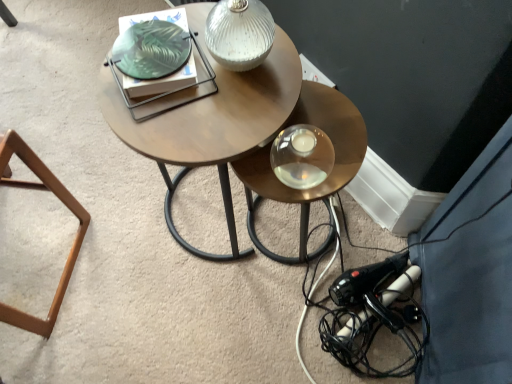
Question: Does white textured glass table lamp at upper center have a greater height compared to black plastic hairdryer at lower right?

Choices:
 (A) no
 (B) yes

Answer: (B)

Question: Is white textured glass table lamp at upper center far away from black plastic hairdryer at lower right?

Choices:
 (A) no
 (B) yes

Answer: (A)

Question: Does white textured glass table lamp at upper center have a lesser width compared to black plastic hairdryer at lower right?

Choices:
 (A) no
 (B) yes

Answer: (B)

Question: From a real-world perspective, is white textured glass table lamp at upper center over black plastic hairdryer at lower right?

Choices:
 (A) yes
 (B) no

Answer: (A)

Question: Is white textured glass table lamp at upper center facing towards black plastic hairdryer at lower right?

Choices:
 (A) yes
 (B) no

Answer: (B)

Question: From a real-world perspective, relative to metallic gold table at center, is woodenmaterial/texturecoffee table at center vertically above or below?

Choices:
 (A) above
 (B) below

Answer: (A)

Question: Is woodenmaterial/texturecoffee table at center taller or shorter than metallic gold table at center?

Choices:
 (A) tall
 (B) short

Answer: (A)

Question: Based on their positions, is woodenmaterial/texturecoffee table at center located to the left or right of metallic gold table at center?

Choices:
 (A) right
 (B) left

Answer: (B)

Question: Considering the positions of point (218, 162) and point (323, 86), is point (218, 162) closer or farther from the camera than point (323, 86)?

Choices:
 (A) closer
 (B) farther

Answer: (A)

Question: In the image, is metallic gold table at center on the left side or the right side of brown wooden stool at lower left?

Choices:
 (A) left
 (B) right

Answer: (B)

Question: From the image's perspective, relative to brown wooden stool at lower left, is metallic gold table at center above or below?

Choices:
 (A) above
 (B) below

Answer: (A)

Question: Is metallic gold table at center situated inside brown wooden stool at lower left or outside?

Choices:
 (A) outside
 (B) inside

Answer: (A)

Question: Is metallic gold table at center in front of or behind brown wooden stool at lower left in the image?

Choices:
 (A) front
 (B) behind

Answer: (B)

Question: Based on their sizes in the image, would you say white textured glass table lamp at upper center is bigger or smaller than black plastic hairdryer at lower right?

Choices:
 (A) small
 (B) big

Answer: (A)

Question: Is point (215, 6) positioned closer to the camera than point (296, 354)?

Choices:
 (A) closer
 (B) farther

Answer: (A)